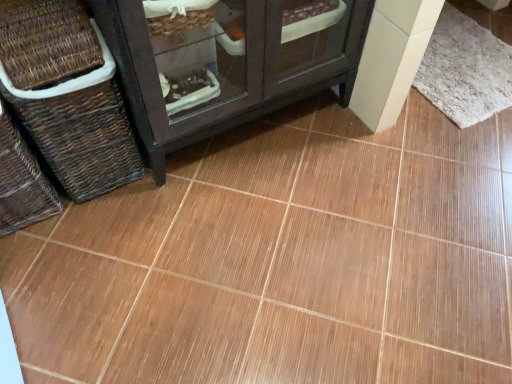
Question: Is the position of brown woven basket at left, the first basket from the right, less distant than that of white fluffy mat at upper right?

Choices:
 (A) yes
 (B) no

Answer: (A)

Question: Is brown woven basket at left, the first basket from the right, thinner than white fluffy mat at upper right?

Choices:
 (A) yes
 (B) no

Answer: (A)

Question: From a real-world perspective, does brown woven basket at left, the first basket from the right, sit lower than white fluffy mat at upper right?

Choices:
 (A) yes
 (B) no

Answer: (B)

Question: Considering the relative sizes of brown woven basket at left, the first basket from the right, and white fluffy mat at upper right in the image provided, is brown woven basket at left, the first basket from the right, smaller than white fluffy mat at upper right?

Choices:
 (A) yes
 (B) no

Answer: (B)

Question: Is brown woven basket at left, the first basket from the right, oriented towards white fluffy mat at upper right?

Choices:
 (A) yes
 (B) no

Answer: (B)

Question: Looking at their shapes, would you say brown woven basket at left, the second basket from the right, is wider or thinner than brown woven basket at left, the first basket from the right?

Choices:
 (A) thin
 (B) wide

Answer: (B)

Question: Considering their positions, is brown woven basket at left, the second basket from the right, located in front of or behind brown woven basket at left, the first basket from the right?

Choices:
 (A) front
 (B) behind

Answer: (A)

Question: Visually, is brown woven basket at left, the second basket from the right, positioned to the left or to the right of brown woven basket at left, acting as the 2th basket starting from the left?

Choices:
 (A) right
 (B) left

Answer: (B)

Question: From a real-world perspective, is brown woven basket at left, the first basket in the left-to-right sequence, above or below brown woven basket at left, acting as the 2th basket starting from the left?

Choices:
 (A) below
 (B) above

Answer: (A)

Question: Looking at the image, does white fluffy mat at upper right seem bigger or smaller compared to brown woven basket at left, the second basket from the right?

Choices:
 (A) big
 (B) small

Answer: (B)

Question: Visually, is white fluffy mat at upper right positioned to the left or to the right of brown woven basket at left, the first basket in the left-to-right sequence?

Choices:
 (A) left
 (B) right

Answer: (B)

Question: Looking at their shapes, would you say white fluffy mat at upper right is wider or thinner than brown woven basket at left, the second basket from the right?

Choices:
 (A) wide
 (B) thin

Answer: (A)

Question: Is white fluffy mat at upper right spatially inside brown woven basket at left, the first basket in the left-to-right sequence, or outside of it?

Choices:
 (A) inside
 (B) outside

Answer: (B)

Question: In terms of width, does white fluffy mat at upper right look wider or thinner when compared to brown woven basket at left, the first basket from the right?

Choices:
 (A) wide
 (B) thin

Answer: (A)

Question: Is point (460, 44) closer or farther from the camera than point (133, 175)?

Choices:
 (A) farther
 (B) closer

Answer: (A)